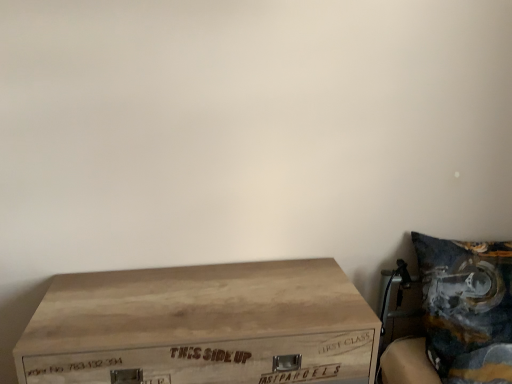
What do you see at coordinates (202, 326) in the screenshot? The width and height of the screenshot is (512, 384). I see `natural wood box at lower left` at bounding box center [202, 326].

Looking at this image, measure the distance between point (328, 273) and camera.

Point (328, 273) is 4.43 feet from camera.

What is the approximate height of natural wood box at lower left?

natural wood box at lower left is 54.09 centimeters in height.

This screenshot has height=384, width=512. I want to click on natural wood box at lower left, so [202, 326].

The width and height of the screenshot is (512, 384). What are the coordinates of `natural wood box at lower left` in the screenshot? It's located at (202, 326).